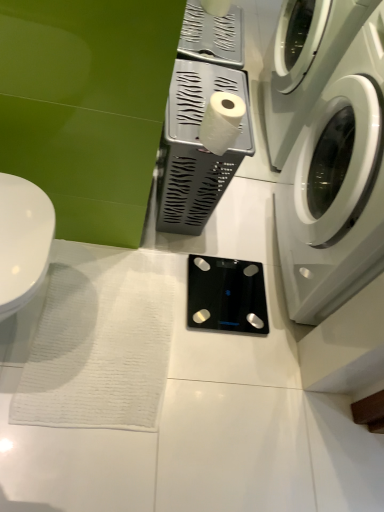
Locate an element on the screen. free space in front of black glass scale at center, which is the first appliance in bottom-to-top order is located at coordinates (210, 362).